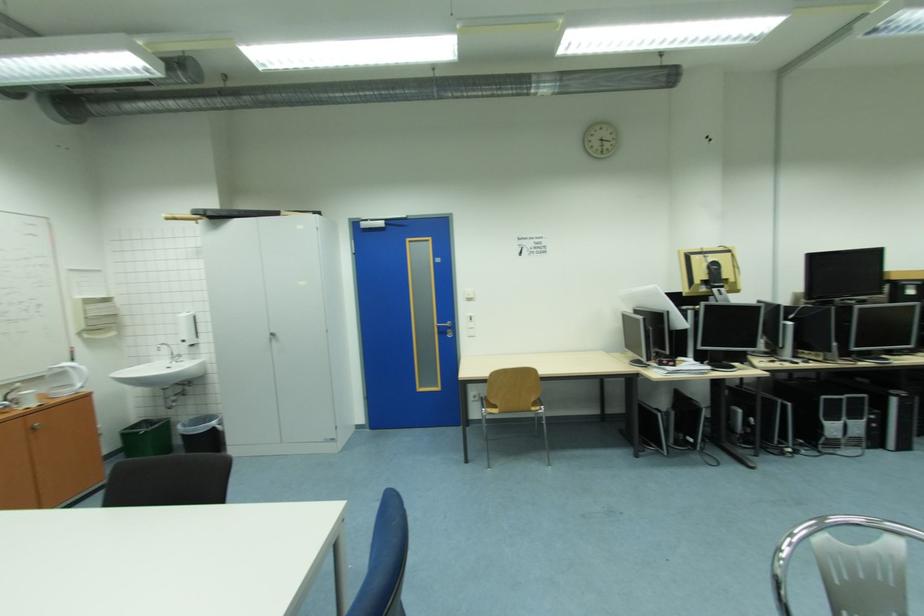
Where would you push the light switch? Please return your answer as a coordinate pair (x, y).

(469, 309)